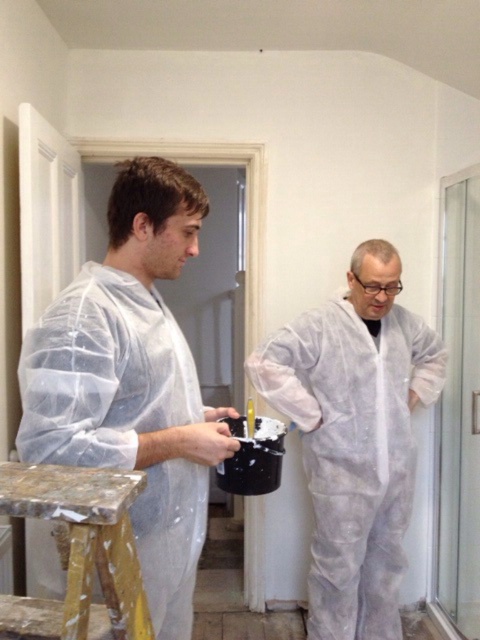
Can you confirm if transparent plastic coat at left is taller than marbled wood stool at lower left?

Correct, transparent plastic coat at left is much taller as marbled wood stool at lower left.

Is point (34, 392) farther from viewer compared to point (84, 493)?

Yes.

Which is in front, point (23, 356) or point (132, 477)?

Point (132, 477) is more forward.

Find the location of a particular element. This screenshot has height=640, width=480. transparent plastic coat at left is located at coordinates (132, 381).

Is transparent plastic coat at left taller than white matte coveralls at center?

No.

Is point (141, 204) behind point (361, 563)?

That is False.

Does point (199, 486) lie in front of point (337, 394)?

Yes.

Where is `transparent plastic coat at left`? transparent plastic coat at left is located at coordinates (132, 381).

Which of these two, white matte coveralls at center or marbled wood stool at lower left, stands taller?

Standing taller between the two is white matte coveralls at center.

Which is above, white matte coveralls at center or marbled wood stool at lower left?

marbled wood stool at lower left is above.

Which is in front, point (425, 400) or point (113, 580)?

Positioned in front is point (113, 580).

The image size is (480, 640). What are the coordinates of `white matte coveralls at center` in the screenshot? It's located at (355, 436).